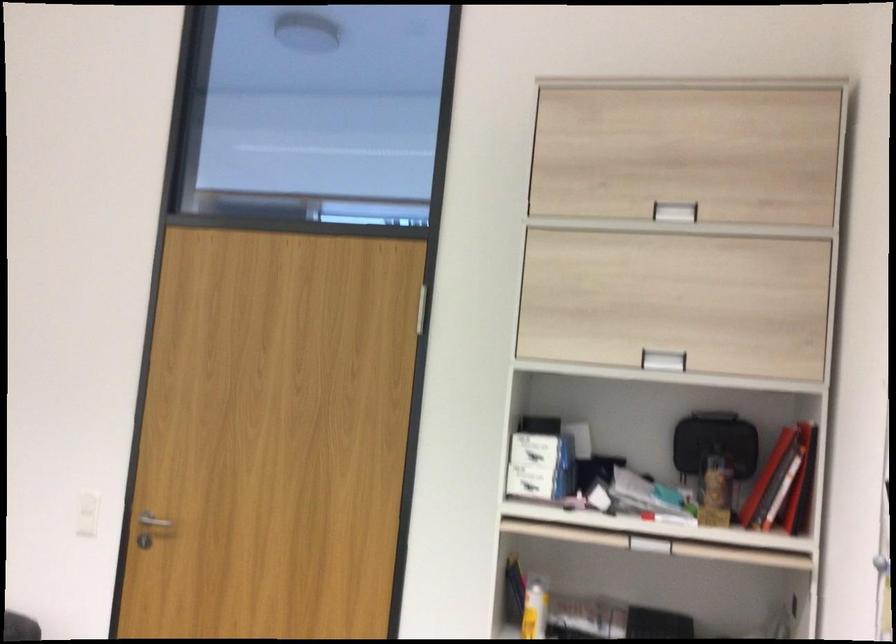
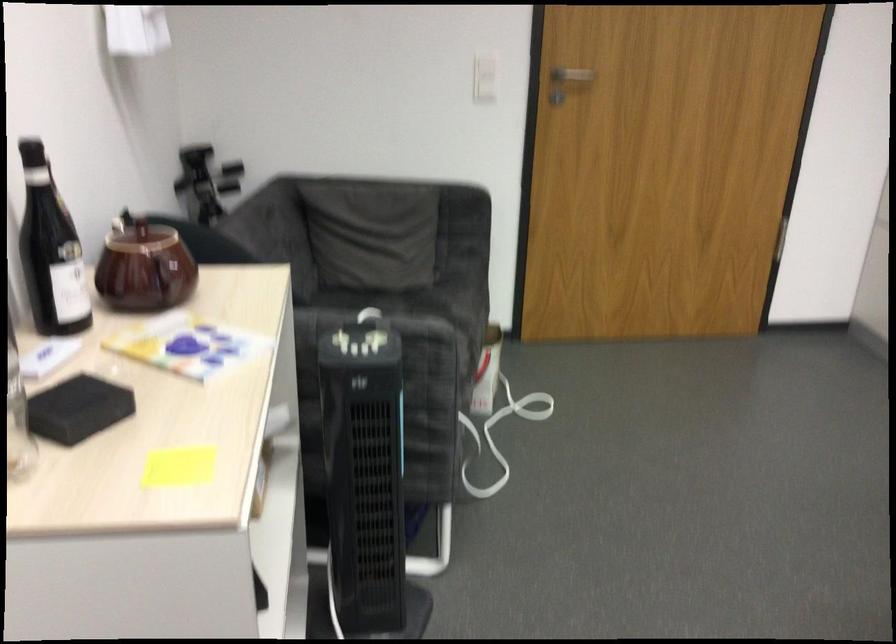
Locate, in the second image, the point that corresponds to [87,516] in the first image.

(484, 77)